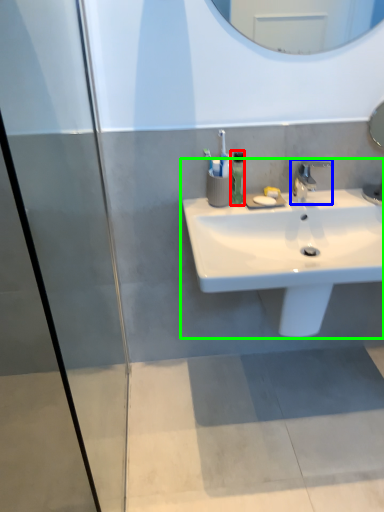
Question: Which object is the farthest from soap dispenser (highlighted by a red box)? Choose among these: tap (highlighted by a blue box) or sink (highlighted by a green box).

Choices:
 (A) tap
 (B) sink

Answer: (B)